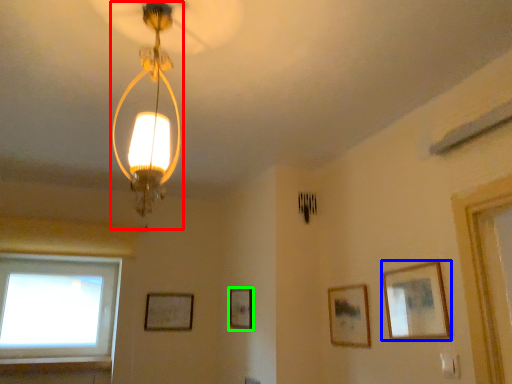
Question: Considering the real-world distances, which object is closest to lamp (highlighted by a red box)? picture frame (highlighted by a blue box) or picture frame (highlighted by a green box).

Choices:
 (A) picture frame
 (B) picture frame

Answer: (A)